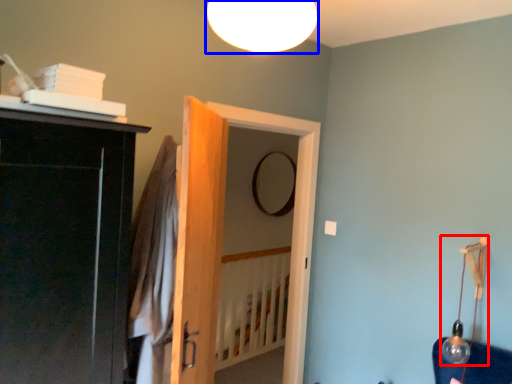
Question: Which object is closer to the camera taking this photo, lamp (highlighted by a red box) or lamp (highlighted by a blue box)?

Choices:
 (A) lamp
 (B) lamp

Answer: (B)